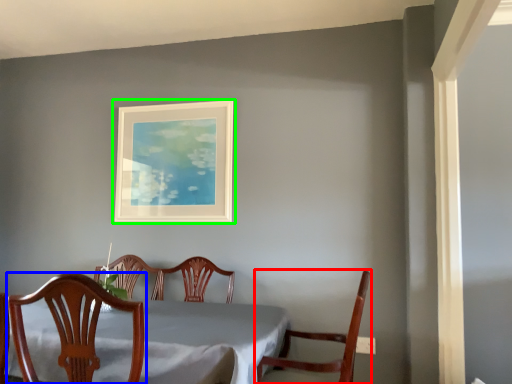
Question: Considering the real-world distances, which object is farthest from chair (highlighted by a red box)? chair (highlighted by a blue box) or picture frame (highlighted by a green box)?

Choices:
 (A) chair
 (B) picture frame

Answer: (B)